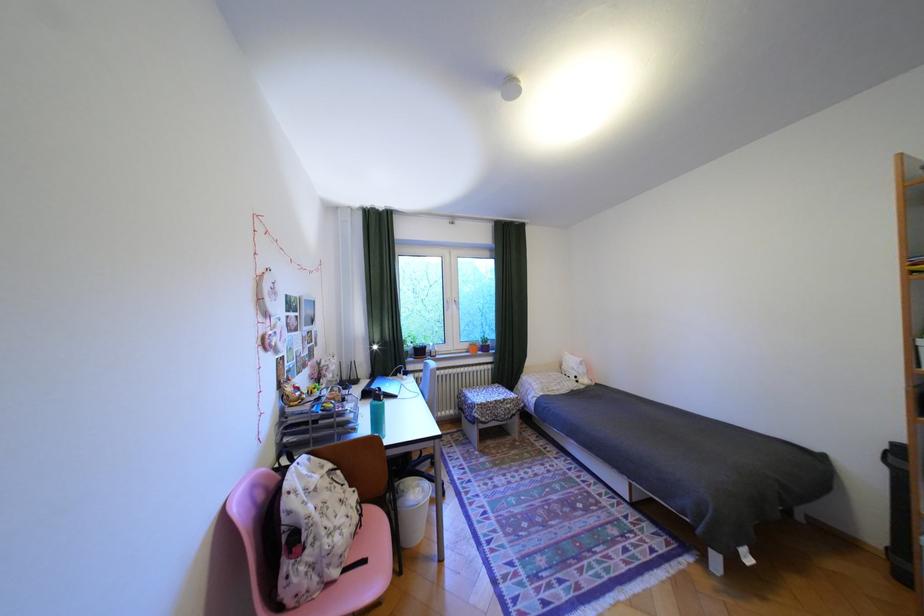
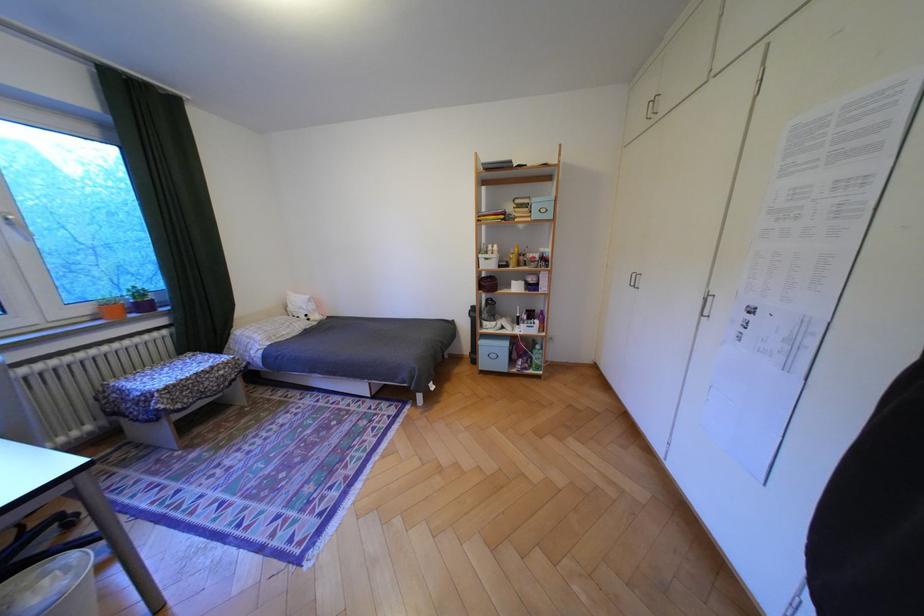
Find the pixel in the second image that matches [429,490] in the first image.

(56, 582)